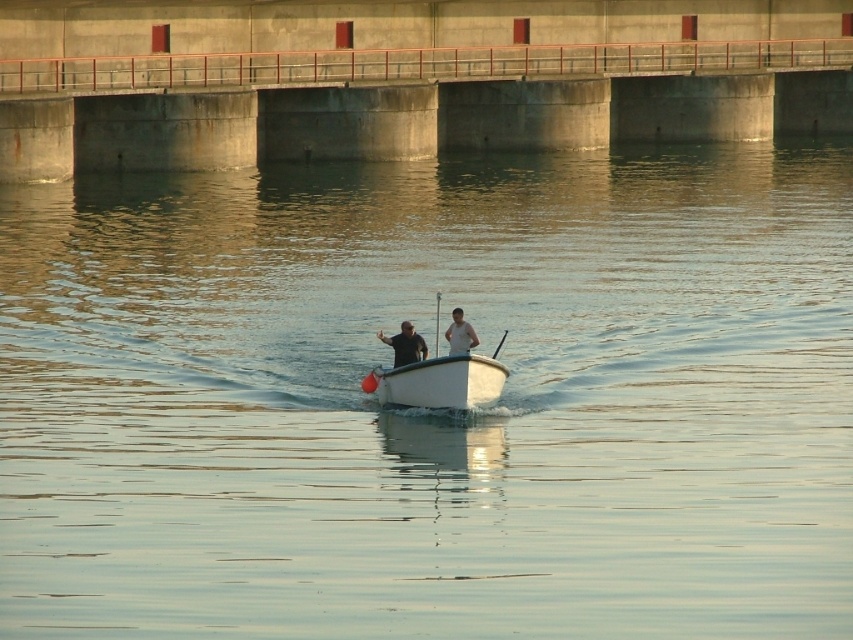
You are a photographer taking a picture of the two people on the boat. Which person should you focus on if you want to capture the taller individual wearing a black matte shirt at center and white matte shirt at center?

The black matte shirt at center is taller than the white matte shirt at center, so you should focus on the person wearing the black matte shirt at center to capture the taller individual.

You are standing on the dam and want to throw a lifebuoy to the person in the white matte shirt at center. The lifebuoy has a diameter of 20 inches. Can you reach the person without the lifebuoy hitting the white plastic boat at center?

The distance between the white plastic boat at center and the white matte shirt at center is 25.76 inches. Since the lifebuoy has a diameter of 20 inches, there is enough space between them to throw the lifebuoy without hitting the boat.